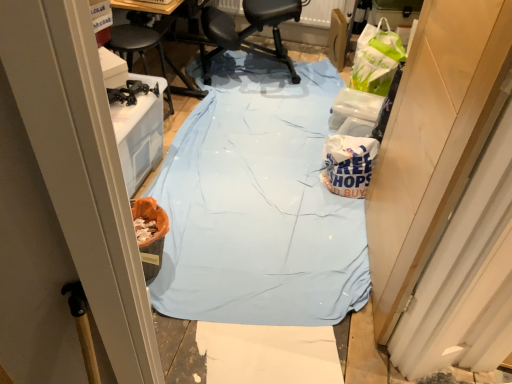
Question: From a real-world perspective, is light blue fabric at center over wooden door at right?

Choices:
 (A) no
 (B) yes

Answer: (A)

Question: From the image's perspective, is light blue fabric at center located above wooden door at right?

Choices:
 (A) no
 (B) yes

Answer: (B)

Question: Is light blue fabric at center further to camera compared to wooden door at right?

Choices:
 (A) yes
 (B) no

Answer: (A)

Question: Would you consider light blue fabric at center to be distant from wooden door at right?

Choices:
 (A) no
 (B) yes

Answer: (A)

Question: Considering the relative sizes of light blue fabric at center and wooden door at right in the image provided, is light blue fabric at center taller than wooden door at right?

Choices:
 (A) yes
 (B) no

Answer: (B)

Question: Does light blue fabric at center have a greater width compared to wooden door at right?

Choices:
 (A) no
 (B) yes

Answer: (B)

Question: Is wooden door at right bigger than white paper bag at center-right?

Choices:
 (A) no
 (B) yes

Answer: (B)

Question: Does wooden door at right have a greater width compared to white paper bag at center-right?

Choices:
 (A) yes
 (B) no

Answer: (B)

Question: Is wooden door at right oriented towards white paper bag at center-right?

Choices:
 (A) no
 (B) yes

Answer: (A)

Question: From a real-world perspective, is wooden door at right over white paper bag at center-right?

Choices:
 (A) yes
 (B) no

Answer: (A)

Question: From a real-world perspective, is wooden door at right located beneath white paper bag at center-right?

Choices:
 (A) yes
 (B) no

Answer: (B)

Question: Is wooden door at right at the left side of white paper bag at center-right?

Choices:
 (A) yes
 (B) no

Answer: (B)

Question: Does white paper bag at center-right come behind black leather chair at center?

Choices:
 (A) yes
 (B) no

Answer: (B)